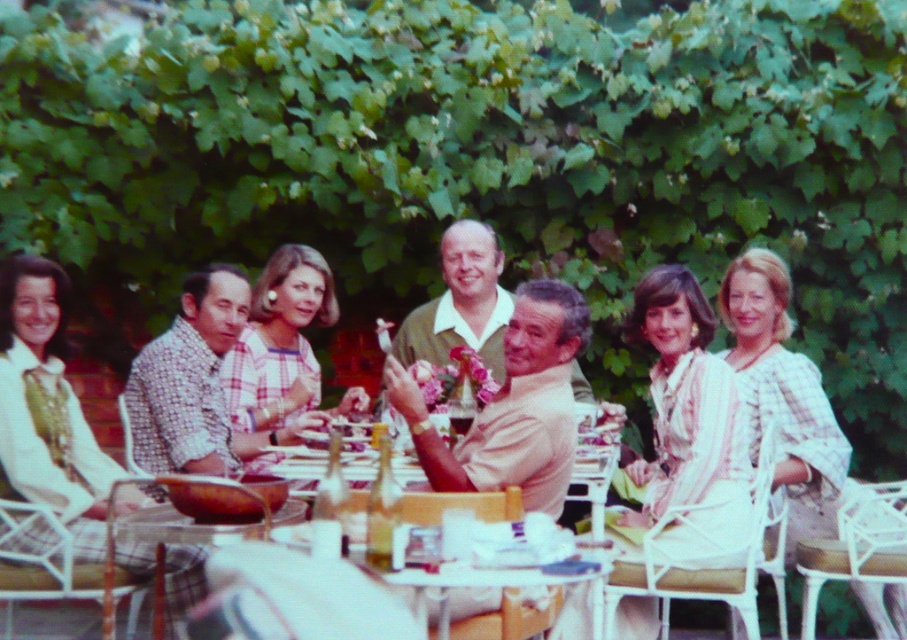
Which of these two, clear glass table at center or light beige fabric shirt at center, stands shorter?

With less height is clear glass table at center.

Can you confirm if clear glass table at center is positioned above light beige fabric shirt at center?

Incorrect, clear glass table at center is not positioned above light beige fabric shirt at center.

Does point (301, 515) come in front of point (476, 272)?

Yes, point (301, 515) is in front of point (476, 272).

Where is `clear glass table at center`? The width and height of the screenshot is (907, 640). clear glass table at center is located at coordinates (192, 525).